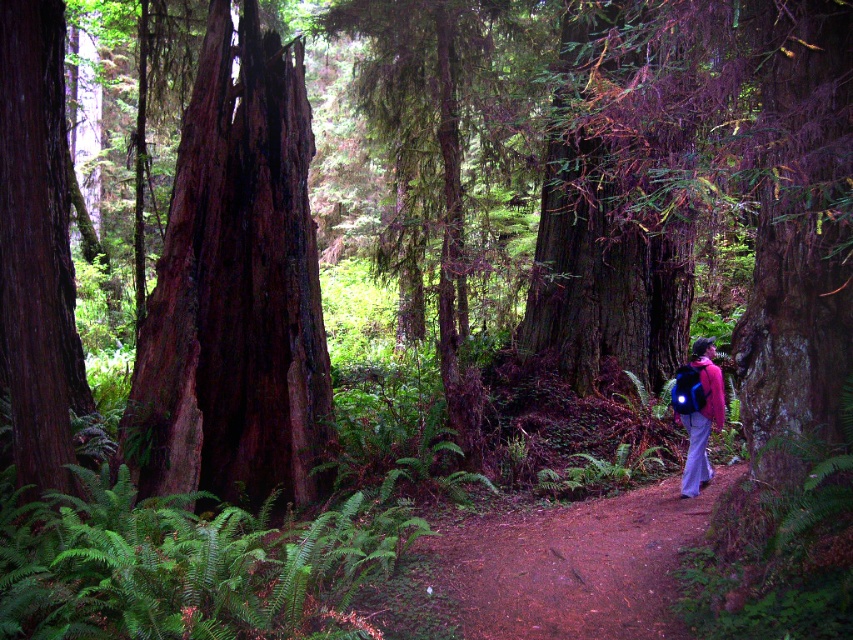
Between green leafy fern at lower left and dark brown bark tree at center, which one appears on the left side from the viewer's perspective?

From the viewer's perspective, green leafy fern at lower left appears more on the left side.

Can you confirm if green leafy fern at lower left is bigger than dark brown bark tree at center?

No.

Where is `green leafy fern at lower left`? This screenshot has width=853, height=640. green leafy fern at lower left is located at coordinates (189, 564).

Is brown dirt path at center positioned behind matte pink jacket at center?

No, brown dirt path at center is closer to the viewer.

Describe the element at coordinates (550, 570) in the screenshot. I see `brown dirt path at center` at that location.

Between point (613, 557) and point (699, 371), which one is positioned in front?

Point (613, 557) is in front.

Locate an element on the screen. This screenshot has height=640, width=853. brown dirt path at center is located at coordinates (550, 570).

Between point (96, 596) and point (402, 605), which one is positioned behind?

Positioned behind is point (402, 605).

Which of these two, green leafy fern at lower left or brown dirt path at center, stands shorter?

brown dirt path at center

Where is `green leafy fern at lower left`? green leafy fern at lower left is located at coordinates (189, 564).